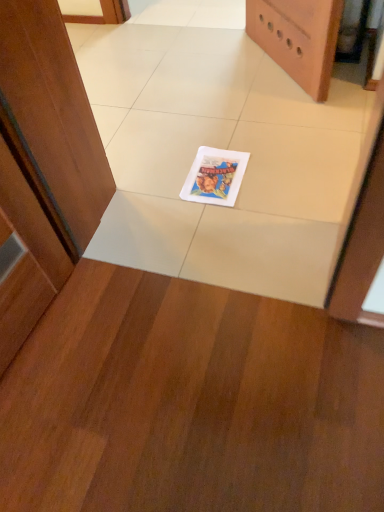
Image resolution: width=384 pixels, height=512 pixels. I want to click on free space underneath matte white comic book at center (from a real-world perspective), so click(219, 170).